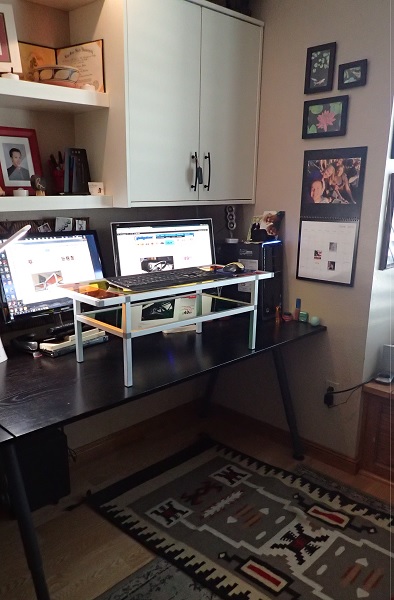
At what (x,y) coordinates should I click in order to perform the action: click on computer monitors. Please return your answer as a coordinate pair (x, y). The width and height of the screenshot is (394, 600). Looking at the image, I should click on (70, 271), (148, 256).